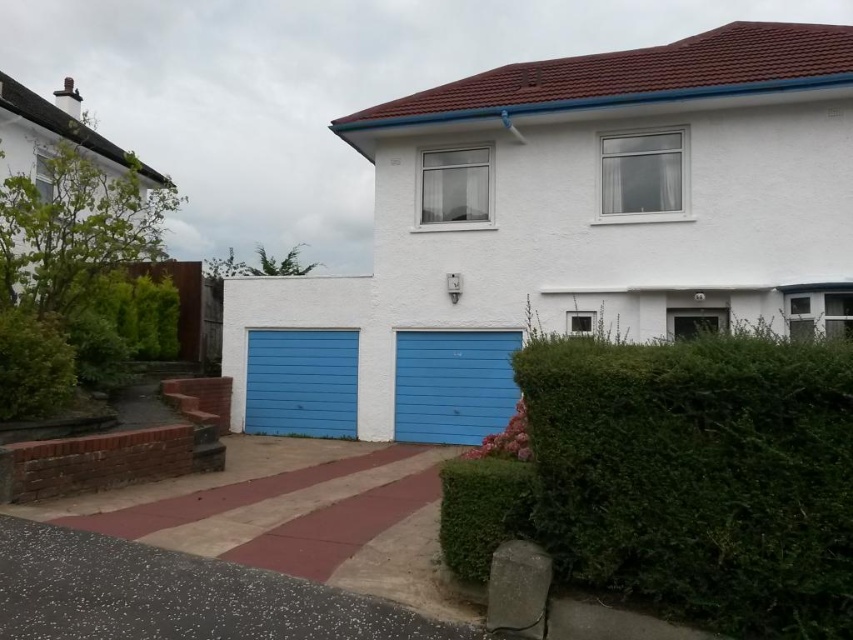
Question: Is blue painted wood garage at center smaller than green leafy hedge at lower right?

Choices:
 (A) yes
 (B) no

Answer: (B)

Question: Which object is positioned farthest from the matte blue garage door at center?

Choices:
 (A) speckled asphalt driveway at lower center
 (B) blue painted wood garage at center
 (C) blue painted wood garage door at center

Answer: (A)

Question: Does matte blue garage door at center lie in front of blue painted wood garage door at center?

Choices:
 (A) yes
 (B) no

Answer: (A)

Question: Can you confirm if blue painted wood garage at center is smaller than speckled asphalt driveway at lower center?

Choices:
 (A) no
 (B) yes

Answer: (A)

Question: Which object is the closest to the green leafy hedge at lower right?

Choices:
 (A) blue painted wood garage door at center
 (B) speckled asphalt driveway at lower center
 (C) matte blue garage door at center
 (D) blue painted wood garage at center

Answer: (B)

Question: Which object is closer to the camera taking this photo?

Choices:
 (A) matte blue garage door at center
 (B) speckled asphalt driveway at lower center

Answer: (B)